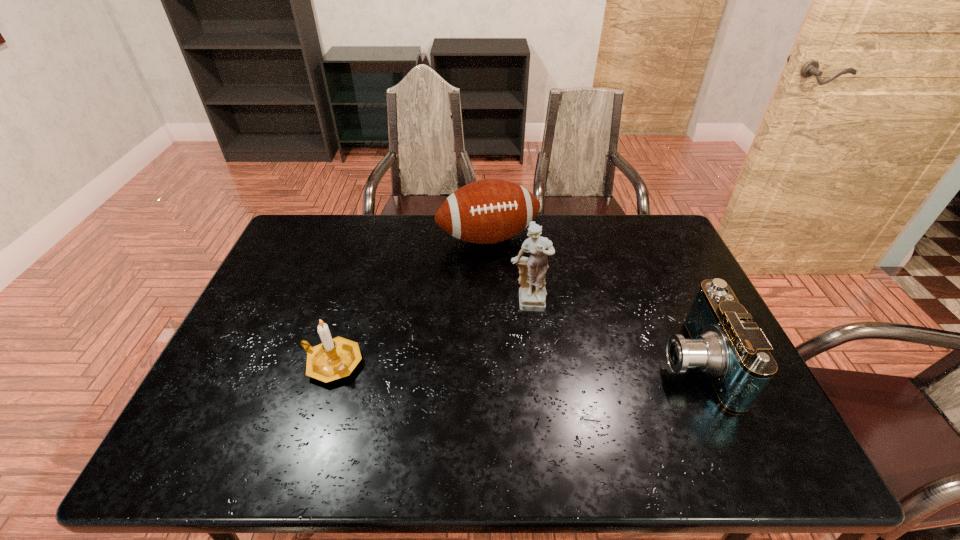
Where is `free space located on the front-facing side of the rightmost object`? This screenshot has width=960, height=540. free space located on the front-facing side of the rightmost object is located at coordinates (553, 363).

Locate an element on the screen. This screenshot has width=960, height=540. free location located on the laces of the third shortest object is located at coordinates (540, 346).

The image size is (960, 540). In order to click on vacant space situated 0.200m on the laces of the third shortest object in this screenshot , I will do `click(519, 299)`.

Locate an element on the screen. The width and height of the screenshot is (960, 540). vacant region located on the laces of the third shortest object is located at coordinates (533, 329).

Identify the location of blank space located 0.220m on the front-facing side of the figurine. The width and height of the screenshot is (960, 540). (540, 388).

Where is `vacant region located on the front-facing side of the figurine`? This screenshot has width=960, height=540. vacant region located on the front-facing side of the figurine is located at coordinates (535, 352).

The height and width of the screenshot is (540, 960). I want to click on free region located 0.220m on the front-facing side of the figurine, so click(x=540, y=388).

This screenshot has height=540, width=960. I want to click on object located at the far edge, so click(488, 211).

I want to click on object that is at the near edge, so click(724, 343).

Image resolution: width=960 pixels, height=540 pixels. What are the coordinates of `object that is positioned at the right edge` in the screenshot? It's located at (724, 343).